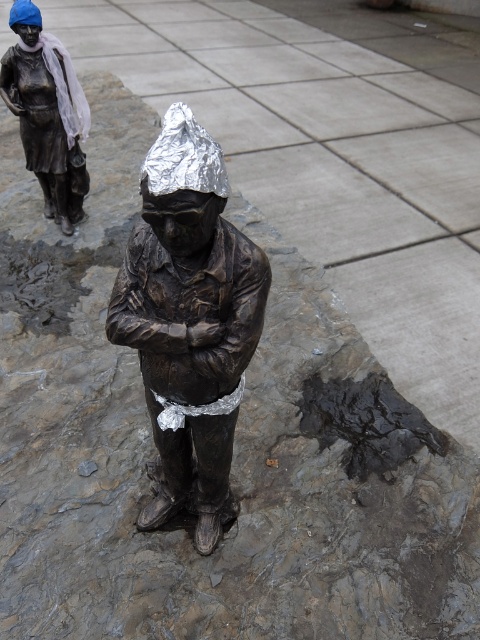
You are standing at the entrance of the plaza and see the bronze statue represented by point (189,317). Can you determine if the statue is positioned in the center of the plaza?

The bronze statue represented by point (189,317) is positioned at the center of the plaza.